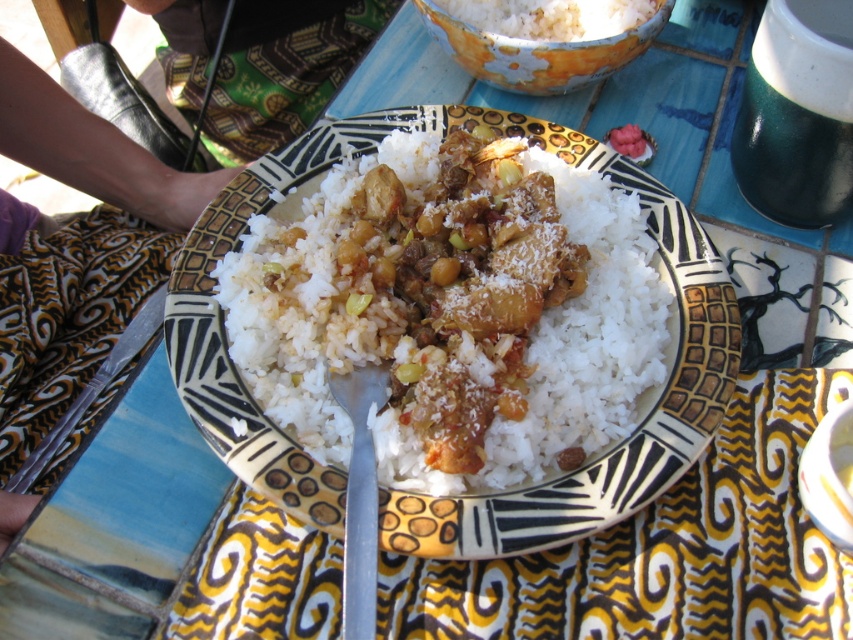
You are looking at the table with the decorative plate and the other dishes. There are two points marked on the table. One is at coordinates point (x=424, y=358) and the other at point (x=563, y=20). Which of these points is closer to you?

Point (x=424, y=358) is closer to the viewer than point (x=563, y=20).

You are a food critic sitting at a table with a plate of white polished rice at center. You want to take a bite of the rice without moving your head. Can you reach it with your fork held in your hand?

The white polished rice at center is 21.93 inches away from viewer. Since the average reach of a person holding a fork is about 22 inches, you can barely reach it with your fork.

You are a chef preparing a dish and need to place the silver metallic fork at center and the white matte rice at upper center on a table. If the table has a width of 20 cm, can both items fit side by side without overlapping?

The silver metallic fork at center is narrower than the white matte rice at upper center. However, since the combined width of both items would exceed the table width of 20 cm, they cannot fit side by side without overlapping.